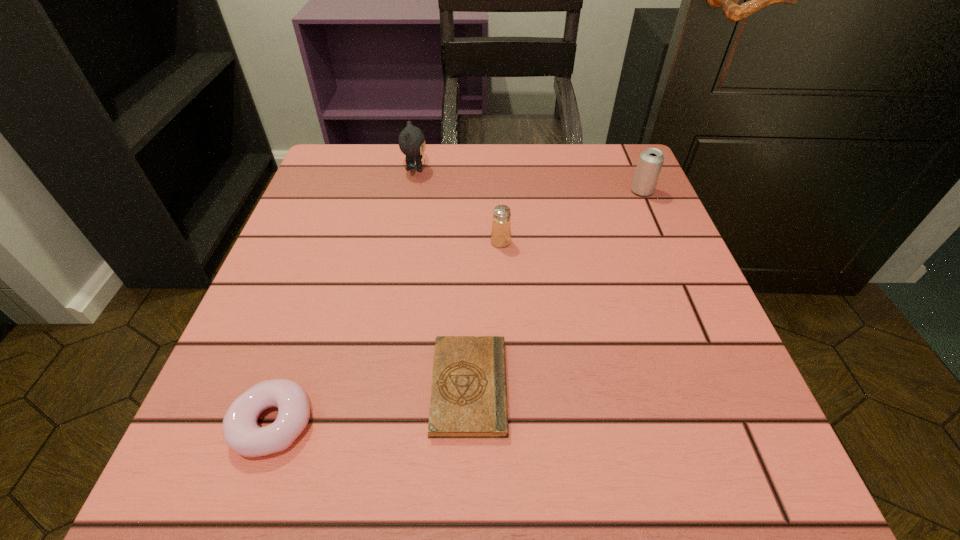
I want to click on kitten, so click(411, 140).

The image size is (960, 540). Identify the location of the fourth object from right to left. (411, 140).

At what (x,y) coordinates should I click in order to perform the action: click on beer can. Please return your answer as a coordinate pair (x, y). Image resolution: width=960 pixels, height=540 pixels. Looking at the image, I should click on (650, 162).

This screenshot has height=540, width=960. Identify the location of the fourth nearest object. (650, 162).

This screenshot has height=540, width=960. Identify the location of the third farthest object. (501, 225).

Identify the location of saltshaker. The width and height of the screenshot is (960, 540). pyautogui.click(x=501, y=225).

Where is `doughnut`? doughnut is located at coordinates (241, 432).

Find the location of a particular element. the leftmost object is located at coordinates (241, 432).

The image size is (960, 540). What are the coordinates of `diary` in the screenshot? It's located at coord(468,399).

Locate an element on the screen. This screenshot has height=540, width=960. vacant space located 0.110m on the front-facing side of the fourth object from right to left is located at coordinates (476, 170).